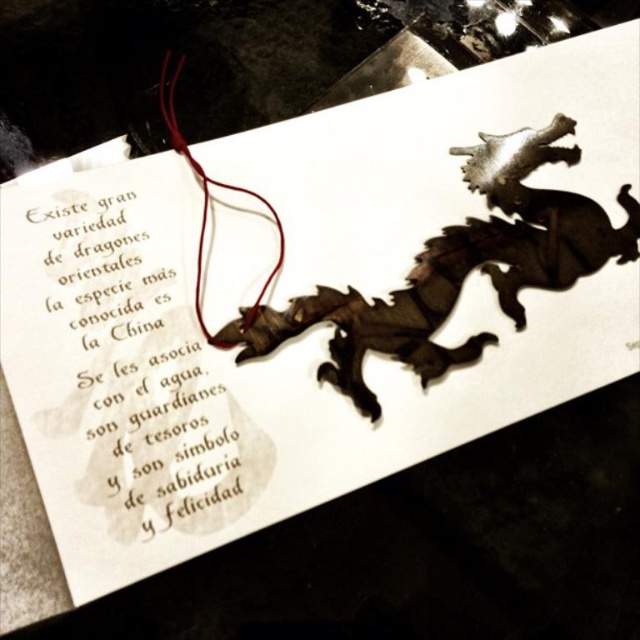
You are designing a bookmark and want to ensure the gold calligraphy text at upper left and the red leather string at upper left are both visible. Based on their sizes, which one should you place closer to the edge to avoid overcrowding?

The gold calligraphy text at upper left is larger than the red leather string at upper left, so to avoid overcrowding, place the smaller red leather string at upper left closer to the edge.

You are designing a new bookmark and want to ensure the gold calligraphy text at upper left is visible next to the metallic silver dragon at center. Based on their sizes, which object should you adjust to make them more balanced?

The gold calligraphy text at upper left is smaller than the metallic silver dragon at center. To balance them, you should enlarge the gold calligraphy text at upper left to match the size of the metallic silver dragon at center.